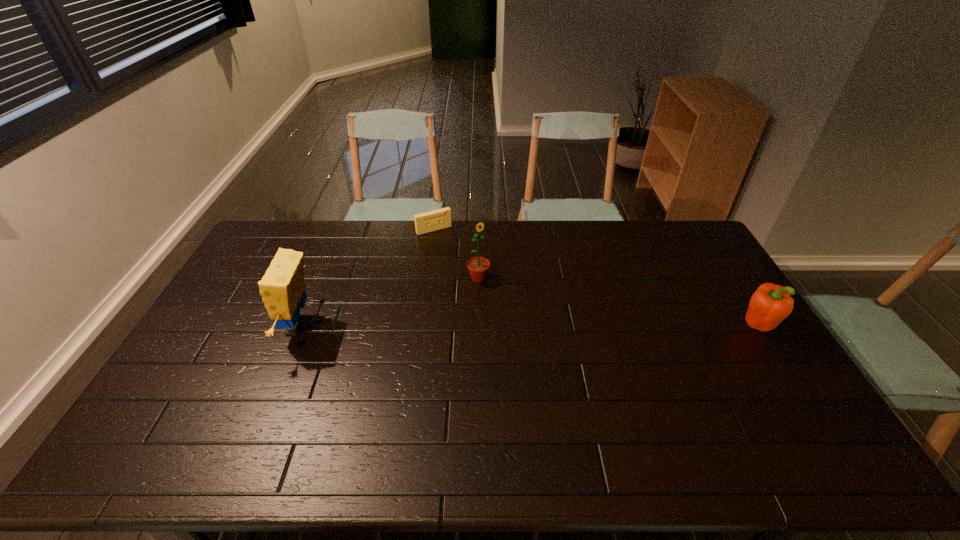
I want to click on sponge, so click(282, 288).

You are a GUI agent. You are given a task and a screenshot of the screen. Output one action in this format:
    pyautogui.click(x=<x>, y=<y>)
    Task: Click on the pepper
    The height and width of the screenshot is (540, 960).
    Given the screenshot: What is the action you would take?
    pyautogui.click(x=770, y=304)

The image size is (960, 540). Find the location of `the second shortest object`. the second shortest object is located at coordinates (770, 304).

In order to click on sunflower in this screenshot , I will do `click(478, 267)`.

Image resolution: width=960 pixels, height=540 pixels. What are the coordinates of `the third object from left to right` in the screenshot? It's located at (478, 267).

The image size is (960, 540). Identify the location of the third object from right to left. (434, 220).

Locate an element on the screen. This screenshot has height=540, width=960. the shortest object is located at coordinates (434, 220).

Where is `free space located 0.210m on the face of the sponge`? free space located 0.210m on the face of the sponge is located at coordinates (208, 326).

In order to click on vacant point located 0.120m on the face of the sponge in this screenshot , I will do `click(238, 326)`.

The height and width of the screenshot is (540, 960). I want to click on free location located 0.110m on the face of the sponge, so click(x=241, y=326).